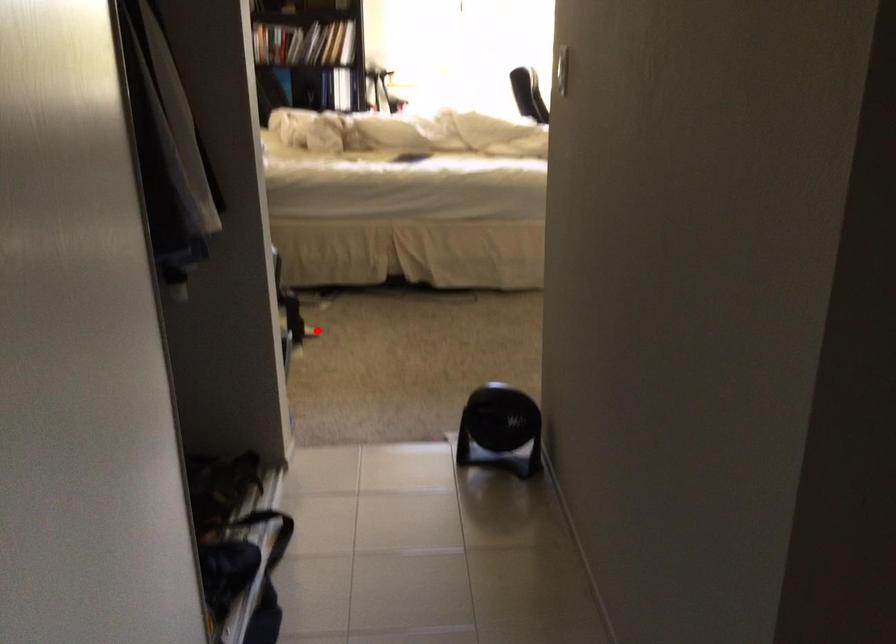
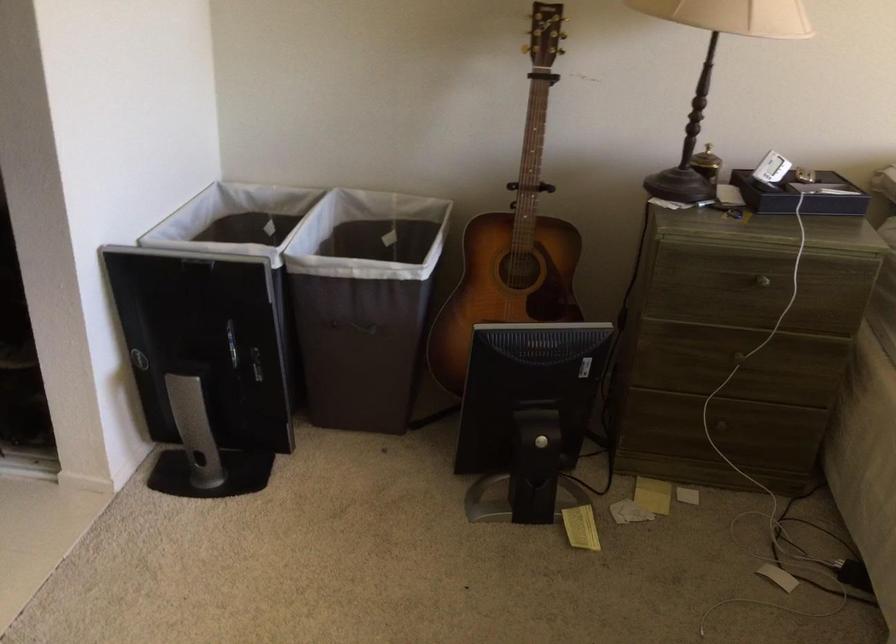
Locate, in the second image, the point that corresponds to the highlighted location in the first image.

(581, 527)